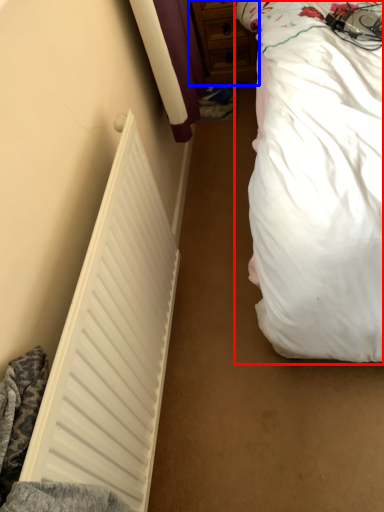
Question: Among these objects, which one is farthest to the camera, bed (highlighted by a red box) or dresser (highlighted by a blue box)?

Choices:
 (A) bed
 (B) dresser

Answer: (B)